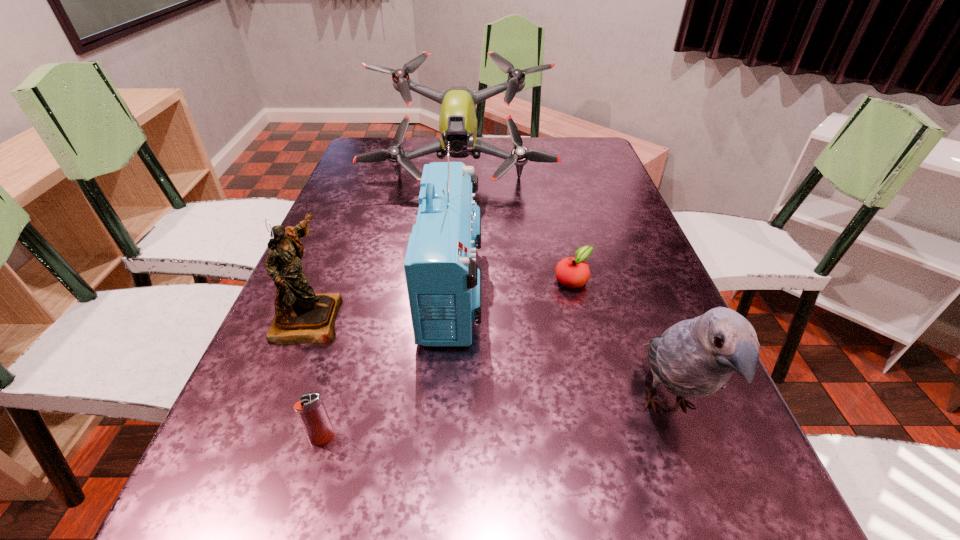
Where is `the farthest object`? This screenshot has width=960, height=540. the farthest object is located at coordinates (457, 122).

This screenshot has height=540, width=960. In order to click on radio receiver in this screenshot , I will do [x=443, y=280].

You are a GUI agent. You are given a task and a screenshot of the screen. Output one action in this format:
    pyautogui.click(x=<x>, y=<y>)
    Task: Click on the parrot
    
    Given the screenshot: What is the action you would take?
    pyautogui.click(x=696, y=357)

At what (x,y) coordinates should I click in order to perform the action: click on figurine. Please return your answer as a coordinate pair (x, y). Looking at the image, I should click on (301, 316).

Where is `the fifth tallest object`? Image resolution: width=960 pixels, height=540 pixels. the fifth tallest object is located at coordinates coord(310,410).

Where is `the shortest object`? This screenshot has height=540, width=960. the shortest object is located at coordinates (573, 272).

I want to click on vacant space situated on the front-facing side of the farthest object, so [x=456, y=223].

Image resolution: width=960 pixels, height=540 pixels. Identify the location of vacant space located on the front-facing side of the radio receiver. (654, 287).

Where is `vacant space located on the front-facing side of the rightmost object`? vacant space located on the front-facing side of the rightmost object is located at coordinates (708, 516).

At what (x,y) coordinates should I click in order to perform the action: click on free space located 0.320m on the front-facing side of the figurine. Please return your answer as a coordinate pair (x, y). This screenshot has height=540, width=960. Looking at the image, I should click on (498, 317).